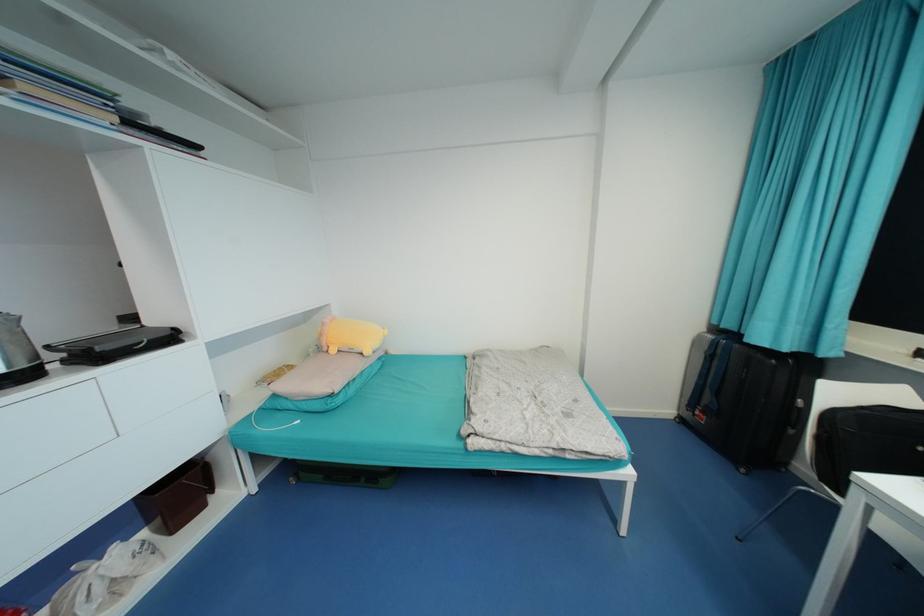
I want to click on black suitcase handle, so click(x=816, y=406).